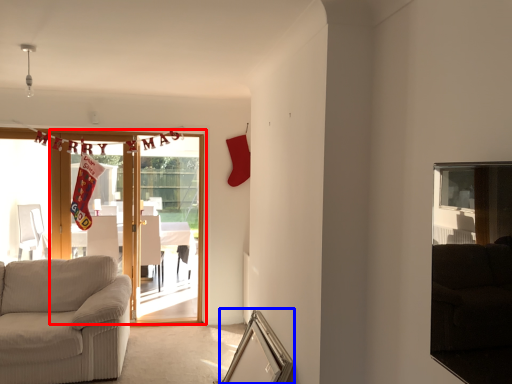
Question: Among these objects, which one is nearest to the camera, door (highlighted by a red box) or picture frame (highlighted by a blue box)?

Choices:
 (A) door
 (B) picture frame

Answer: (B)